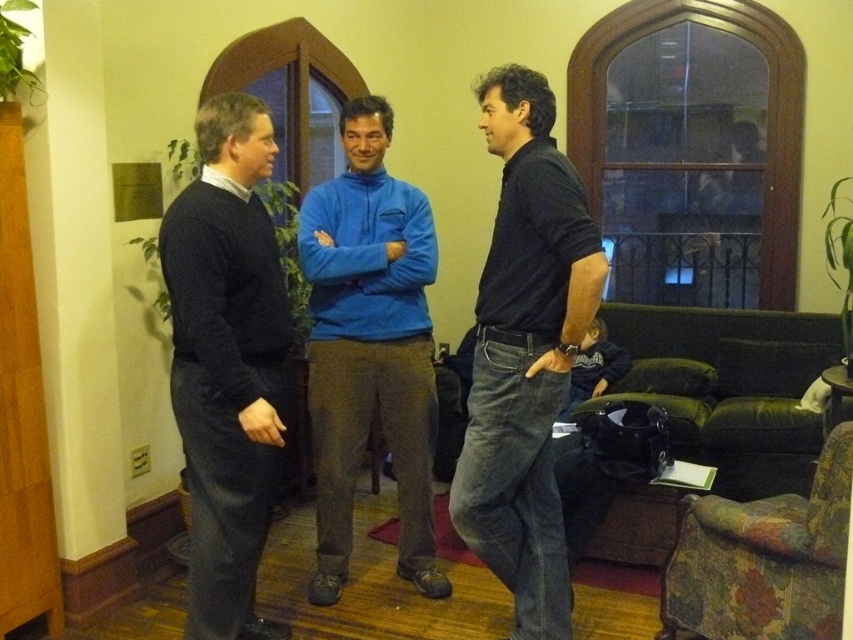
Can you confirm if dark blue sweater at left is bigger than blue fleece jacket at center?

Incorrect, dark blue sweater at left is not larger than blue fleece jacket at center.

Does dark blue sweater at left appear under blue fleece jacket at center?

Indeed, dark blue sweater at left is positioned under blue fleece jacket at center.

Is point (200, 588) farther from camera compared to point (315, 404)?

No.

Find the location of a particular element. This screenshot has width=853, height=640. dark blue sweater at left is located at coordinates (227, 362).

Who is positioned more to the right, dark blue jeans at center or dark blue sweater at left?

Positioned to the right is dark blue jeans at center.

Does dark blue jeans at center have a greater height compared to dark blue sweater at left?

Yes.

Consider the image. Who is more distant from viewer, (527, 204) or (234, 412)?

The point (234, 412) is behind.

The height and width of the screenshot is (640, 853). I want to click on dark blue jeans at center, so click(525, 353).

Where is `dark blue sweater at left`? This screenshot has height=640, width=853. dark blue sweater at left is located at coordinates (227, 362).

Does dark blue sweater at left lie in front of multicolored fabric armchair at lower right?

That is False.

The height and width of the screenshot is (640, 853). I want to click on dark blue sweater at left, so [227, 362].